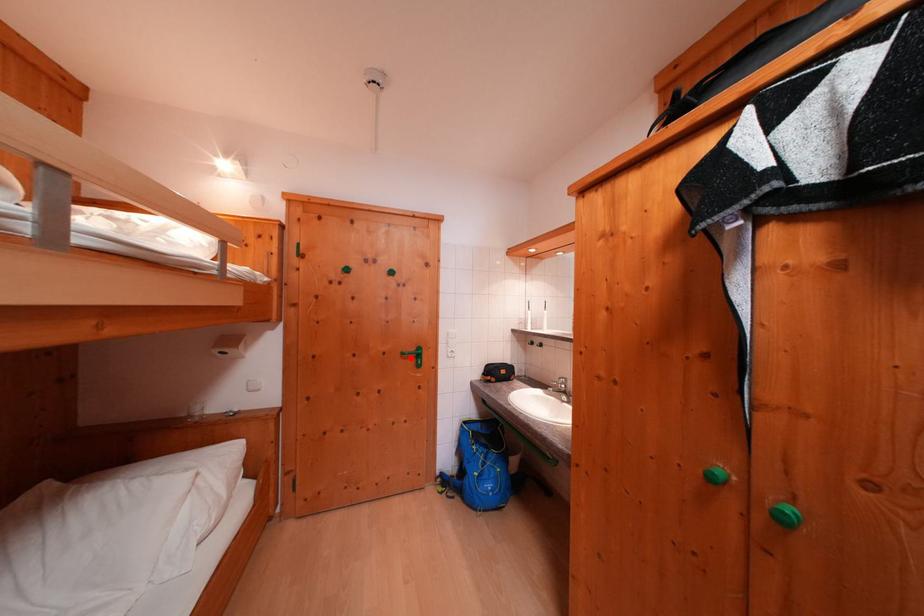
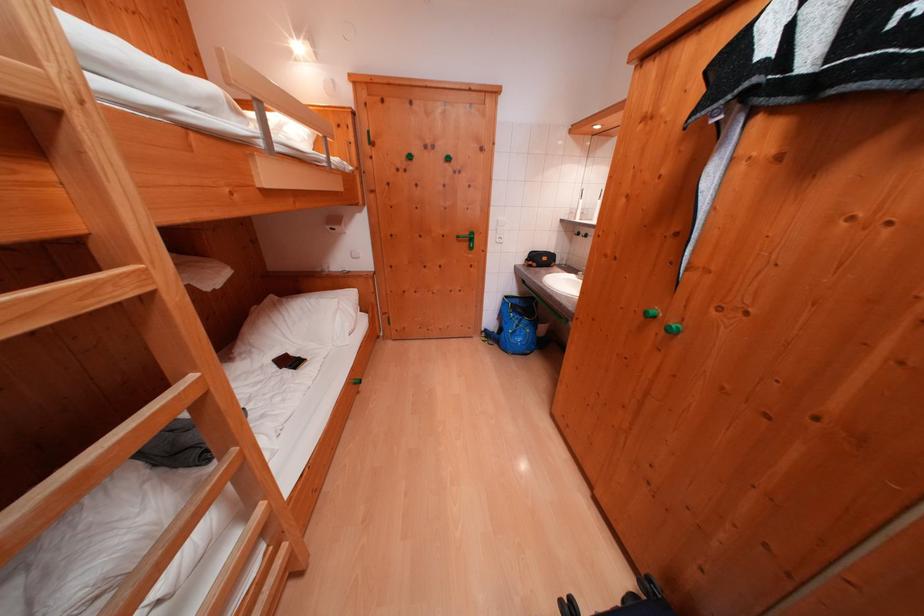
Question: I am providing you with two images of the same scene from different viewpoints. Image1 has a red point marked. In image2, the corresponding 3D location appears at what relative position? Reply with the corresponding letter.

Choices:
 (A) Closer
 (B) Farther

Answer: (A)